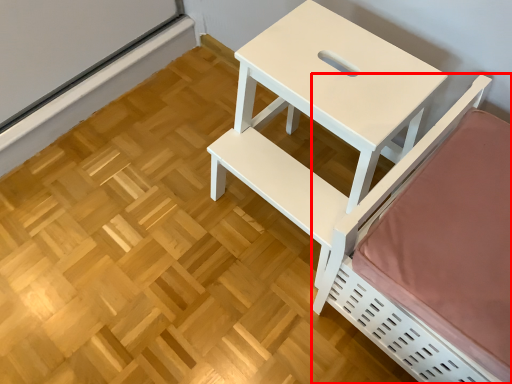
Question: From the image's perspective, what is the correct spatial relationship of furniture (annotated by the red box) in relation to table?

Choices:
 (A) below
 (B) above

Answer: (A)